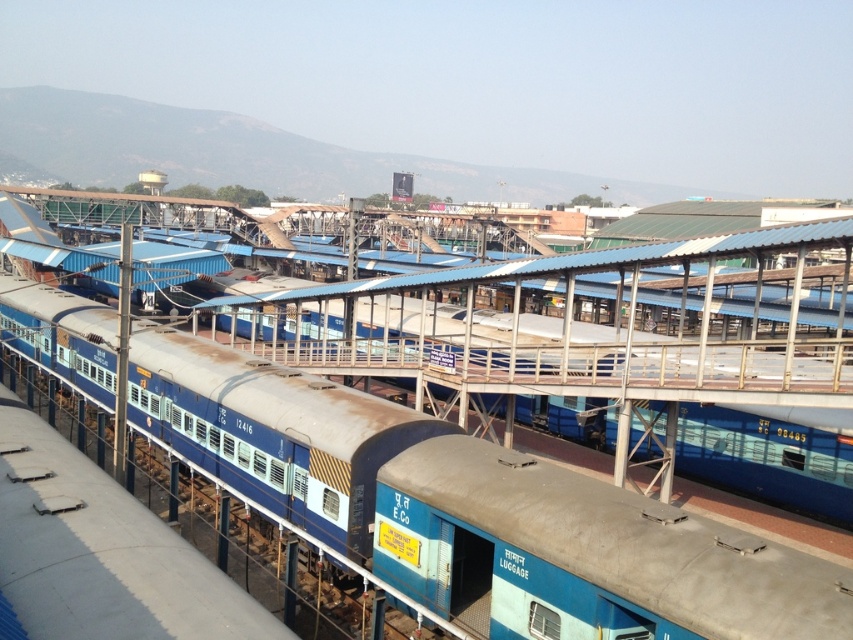
Is blue painted metal train car at center behind blue matte luggage at center?

Yes, blue painted metal train car at center is further from the viewer.

Find the location of `blue painted metal train car at center`. blue painted metal train car at center is located at coordinates (471, 509).